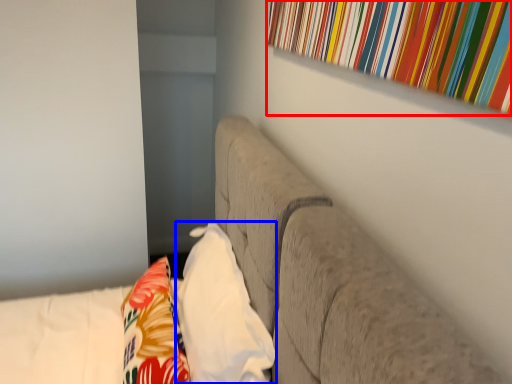
Question: Which object appears closest to the camera in this image, curtain (highlighted by a red box) or pillow (highlighted by a blue box)?

Choices:
 (A) curtain
 (B) pillow

Answer: (A)